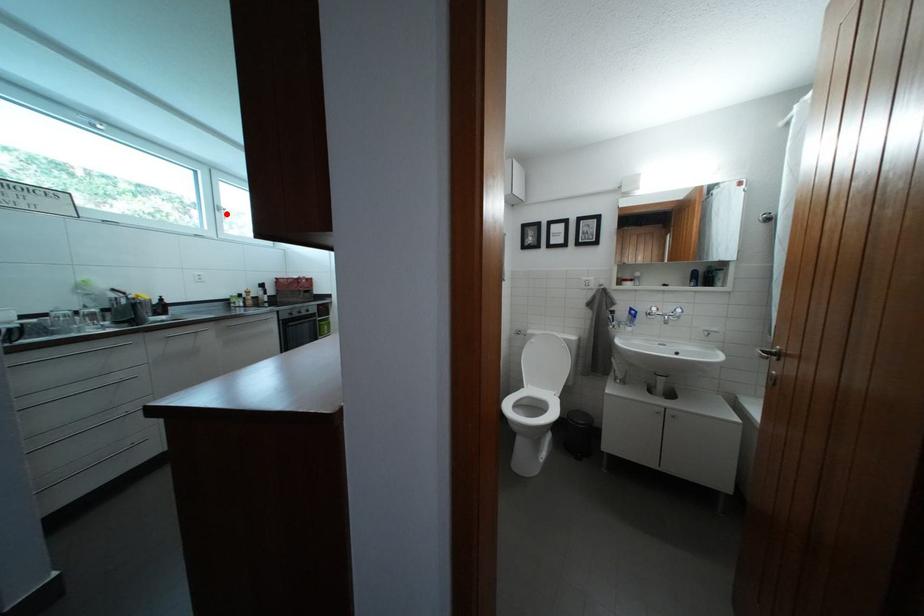
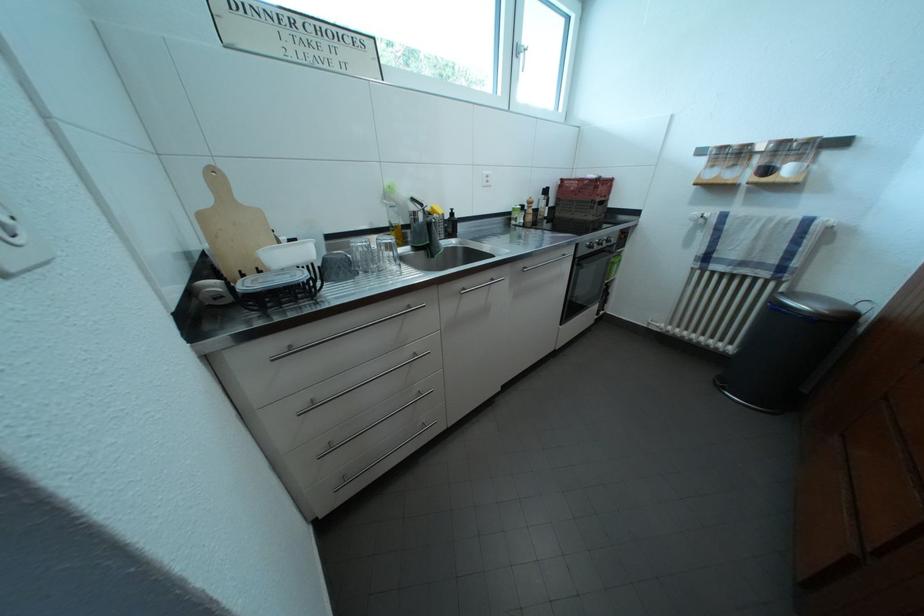
The point at the highlighted location is marked in the first image. Where is the corresponding point in the second image?

(525, 55)